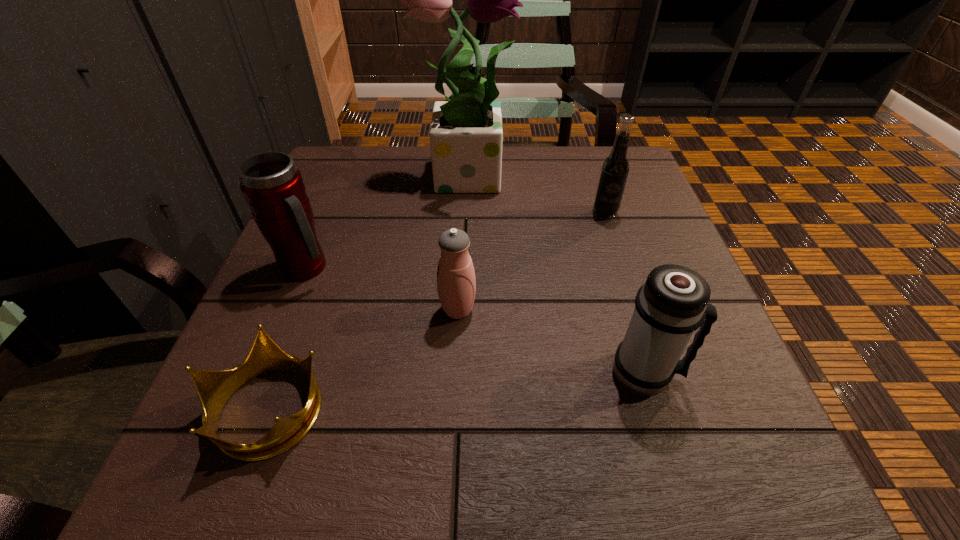
Identify the location of vacant area between the rightmost thermos bottle and the leftmost thermos bottle. The width and height of the screenshot is (960, 540). [476, 320].

Locate an element on the screen. This screenshot has width=960, height=540. free spot between the fifth nearest object and the tallest object is located at coordinates (535, 193).

Find the location of a particular element. This screenshot has height=540, width=960. vacant area that lies between the second thermos bottle from right to left and the fifth nearest object is located at coordinates (531, 261).

In order to click on vacant space in between the crown and the root beer in this screenshot , I will do `click(436, 310)`.

Identify the location of empty space that is in between the rightmost thermos bottle and the second farthest thermos bottle. The width and height of the screenshot is (960, 540). (551, 341).

Locate which object is the fourth closest to the crown. Please provide its 2D coordinates. Your answer should be formatted as a tuple, i.e. [(x, y)], where the tuple contains the x and y coordinates of a point satisfying the conditions above.

[(466, 135)]

Identify which object is located as the fourth nearest to the farthest thermos bottle. Please provide its 2D coordinates. Your answer should be formatted as a tuple, i.e. [(x, y)], where the tuple contains the x and y coordinates of a point satisfying the conditions above.

[(672, 304)]

At what (x,y) coordinates should I click in order to perform the action: click on thermos bottle that is the second closest to the farthest thermos bottle. Please return your answer as a coordinate pair (x, y). Looking at the image, I should click on (672, 304).

Where is `the third closest thermos bottle relative to the shortest object`? the third closest thermos bottle relative to the shortest object is located at coordinates (672, 304).

The image size is (960, 540). Find the location of `vacant region that satisfies the following two spatial constraints: 1. on the label of the root beer; 2. on the side with the handle of the third farthest object`. vacant region that satisfies the following two spatial constraints: 1. on the label of the root beer; 2. on the side with the handle of the third farthest object is located at coordinates (623, 268).